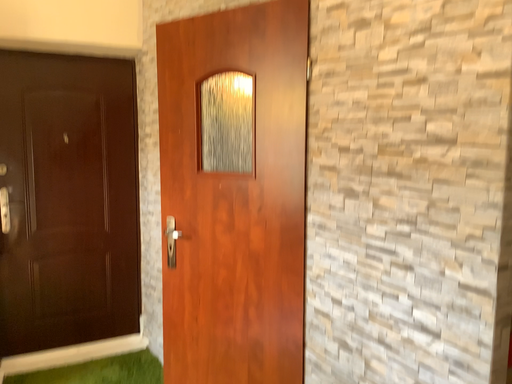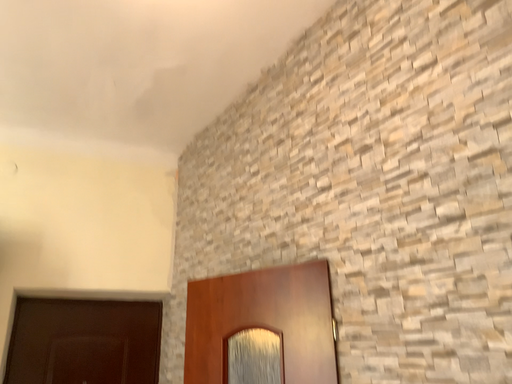
Question: How did the camera likely rotate when shooting the video?

Choices:
 (A) rotated downward
 (B) rotated upward

Answer: (B)